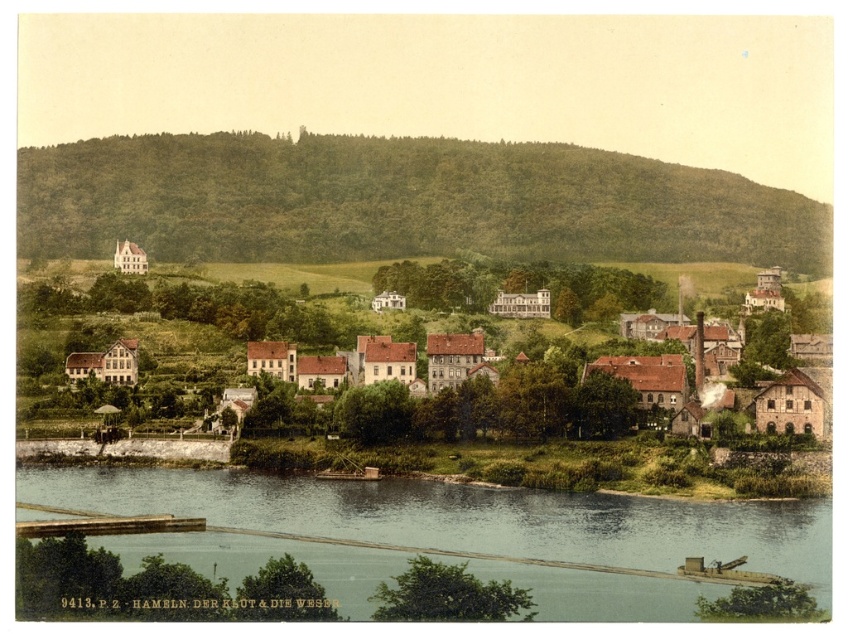
Question: Which point is closer to the camera taking this photo?

Choices:
 (A) (305, 243)
 (B) (583, 616)
 (C) (616, 432)

Answer: (B)

Question: Among these objects, which one is farthest from the camera?

Choices:
 (A) clear water at lower center
 (B) green textured hillside at upper center
 (C) brown wooden houses at center

Answer: (B)

Question: Can you confirm if green textured hillside at upper center is positioned to the right of clear water at lower center?

Choices:
 (A) yes
 (B) no

Answer: (A)

Question: Is green textured hillside at upper center to the right of clear water at lower center from the viewer's perspective?

Choices:
 (A) yes
 (B) no

Answer: (A)

Question: Does green textured hillside at upper center have a larger size compared to clear water at lower center?

Choices:
 (A) yes
 (B) no

Answer: (A)

Question: Considering the real-world distances, which object is closest to the brown wooden houses at center?

Choices:
 (A) clear water at lower center
 (B) green textured hillside at upper center

Answer: (A)